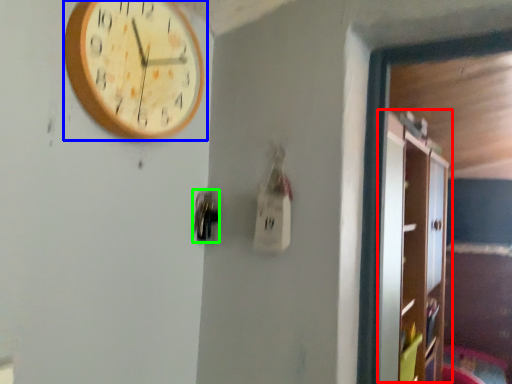
Question: Based on their relative distances, which object is farther from dresser (highlighted by a red box)? Choose from wall clock (highlighted by a blue box) and door handle (highlighted by a green box).

Choices:
 (A) wall clock
 (B) door handle

Answer: (B)